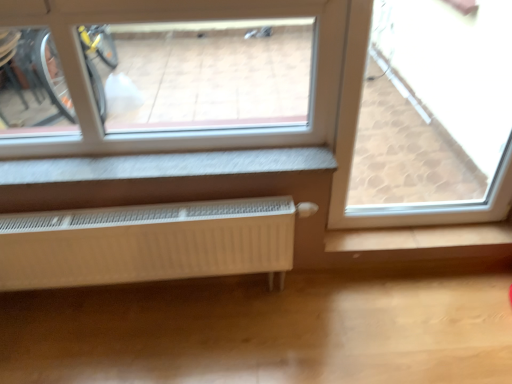
Question: Considering the relative sizes of white matte radiator at lower center and transparent glass window at upper right in the image provided, is white matte radiator at lower center thinner than transparent glass window at upper right?

Choices:
 (A) yes
 (B) no

Answer: (A)

Question: Can you confirm if white matte radiator at lower center is taller than transparent glass window at upper right?

Choices:
 (A) no
 (B) yes

Answer: (A)

Question: Is there a large distance between white matte radiator at lower center and transparent glass window at upper right?

Choices:
 (A) no
 (B) yes

Answer: (A)

Question: From the image's perspective, does white matte radiator at lower center appear lower than transparent glass window at upper right?

Choices:
 (A) no
 (B) yes

Answer: (B)

Question: Does white matte radiator at lower center have a smaller size compared to transparent glass window at upper right?

Choices:
 (A) yes
 (B) no

Answer: (A)

Question: Considering the relative positions of white matte radiator at lower center and transparent glass window at upper right in the image provided, is white matte radiator at lower center in front of transparent glass window at upper right?

Choices:
 (A) no
 (B) yes

Answer: (A)

Question: Is transparent glass window at upper right taller than white matte radiator at lower center?

Choices:
 (A) no
 (B) yes

Answer: (B)

Question: Is transparent glass window at upper right further to camera compared to white matte radiator at lower center?

Choices:
 (A) yes
 (B) no

Answer: (B)

Question: Is transparent glass window at upper right smaller than white matte radiator at lower center?

Choices:
 (A) yes
 (B) no

Answer: (B)

Question: From a real-world perspective, does transparent glass window at upper right sit lower than white matte radiator at lower center?

Choices:
 (A) yes
 (B) no

Answer: (B)

Question: From the image's perspective, is transparent glass window at upper right under white matte radiator at lower center?

Choices:
 (A) yes
 (B) no

Answer: (B)

Question: Is transparent glass window at upper right thinner than white matte radiator at lower center?

Choices:
 (A) yes
 (B) no

Answer: (B)

Question: In the image, is white matte radiator at lower center positioned in front of or behind transparent glass window at upper right?

Choices:
 (A) behind
 (B) front

Answer: (A)